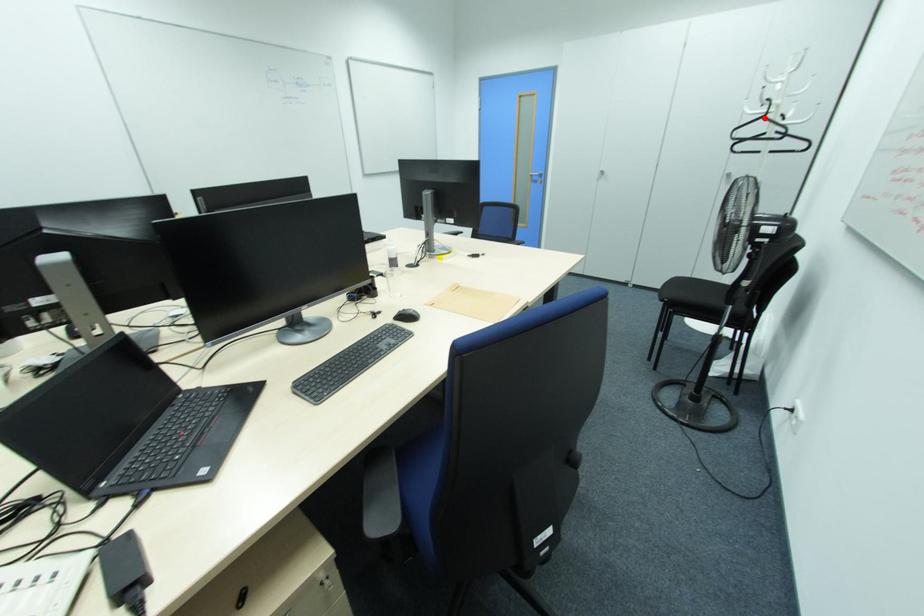
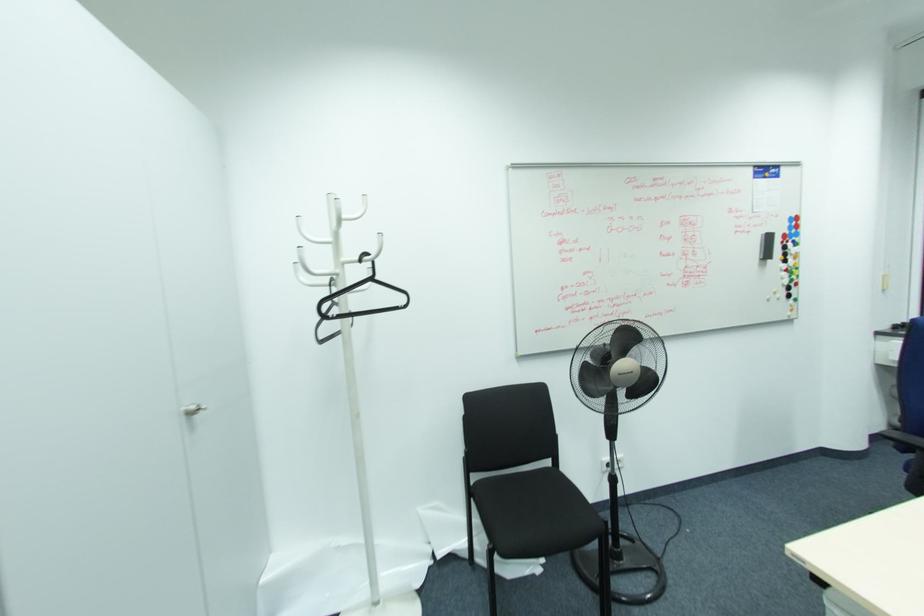
In the second image, find the point that corresponds to the highlighted location in the first image.

(371, 280)